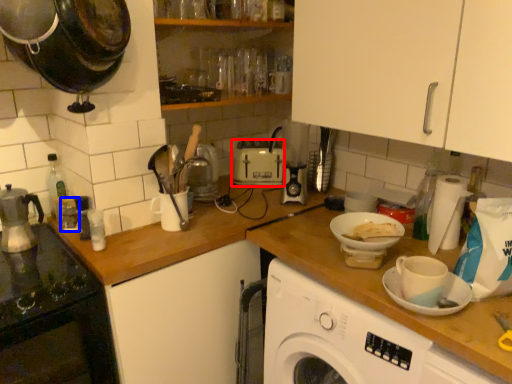
Question: Which object is closer to the camera taking this photo, toaster (highlighted by a red box) or appliance (highlighted by a blue box)?

Choices:
 (A) toaster
 (B) appliance

Answer: (B)